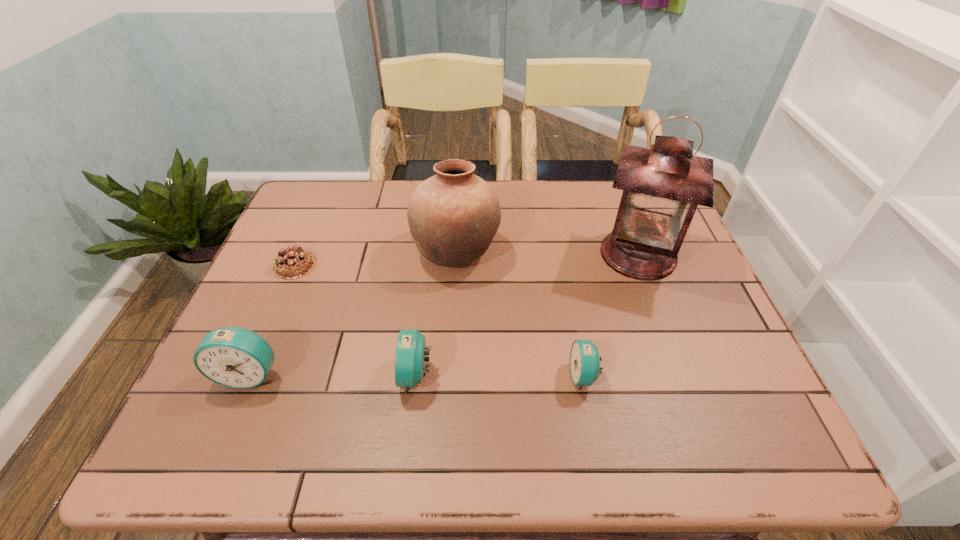
The image size is (960, 540). In the image, there is a desktop. Identify the location of vacant space at the near right corner. (691, 396).

Locate an element on the screen. free space between the second alarm clock from left to right and the rightmost alarm clock is located at coordinates (500, 375).

Find the location of a particular element. The height and width of the screenshot is (540, 960). free point between the fifth shortest object and the leftmost alarm clock is located at coordinates (353, 313).

What are the coordinates of `free space between the shortest object and the second tallest alarm clock` in the screenshot? It's located at (355, 320).

This screenshot has width=960, height=540. Identify the location of unoccupied position between the pottery and the fourth tallest object. (436, 313).

Locate an element on the screen. This screenshot has width=960, height=540. free space between the shortest object and the leftmost alarm clock is located at coordinates (273, 319).

I want to click on vacant space that is in between the pottery and the rightmost object, so click(547, 253).

Where is `vacant area between the leftmost alarm clock and the second tallest object`? vacant area between the leftmost alarm clock and the second tallest object is located at coordinates (353, 313).

I want to click on blank region between the rightmost object and the leftmost alarm clock, so click(444, 314).

The image size is (960, 540). Identify the location of free spot between the pottery and the fourth shortest object. (353, 313).